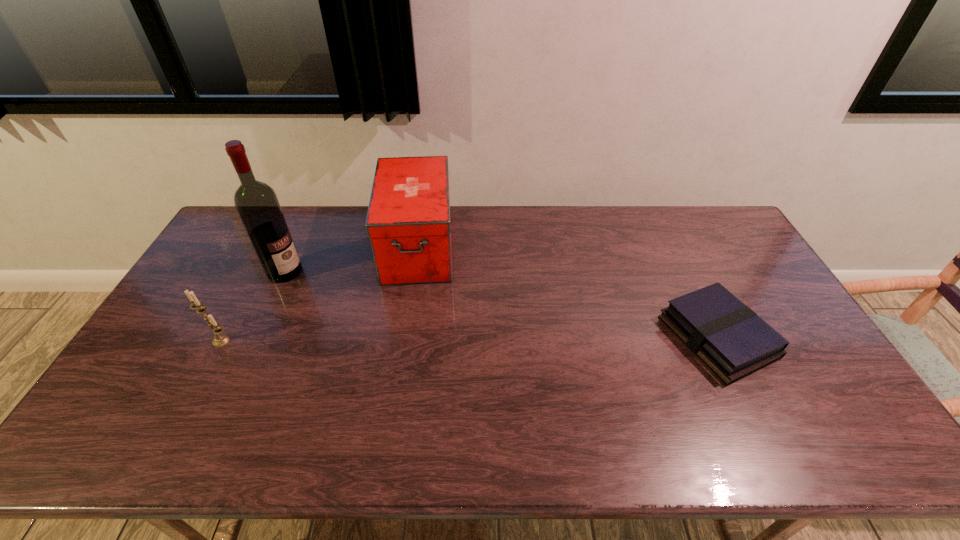
Locate an element on the screen. The width and height of the screenshot is (960, 540). the second shortest object is located at coordinates (219, 340).

Locate an element on the screen. This screenshot has height=540, width=960. book is located at coordinates (731, 339).

The width and height of the screenshot is (960, 540). What are the coordinates of `the shortest object` in the screenshot? It's located at (731, 339).

Identify the location of the first-aid kit. (408, 223).

The width and height of the screenshot is (960, 540). In order to click on the third object from left to right in this screenshot , I will do `click(408, 223)`.

At what (x,y) coordinates should I click in order to perform the action: click on the tallest object. Please return your answer as a coordinate pair (x, y). The width and height of the screenshot is (960, 540). Looking at the image, I should click on (257, 204).

In order to click on vacant region located 0.260m on the back of the candle in this screenshot , I will do `click(261, 265)`.

Where is `vacant space positioned on the back of the rightmost object`? vacant space positioned on the back of the rightmost object is located at coordinates (661, 222).

The height and width of the screenshot is (540, 960). I want to click on vacant point located on the handle side of the second object from right to left, so click(x=413, y=313).

I want to click on free space located 0.180m on the handle side of the second object from right to left, so click(412, 331).